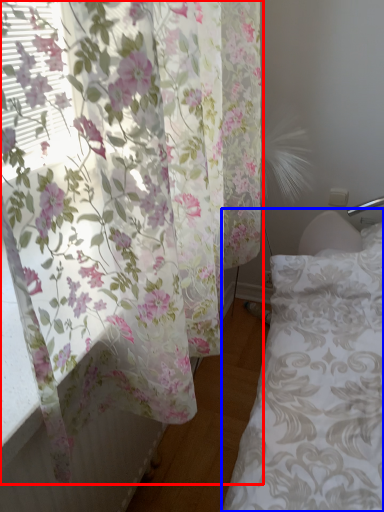
Question: Which object is closer to the camera taking this photo, curtain (highlighted by a red box) or bed frame (highlighted by a blue box)?

Choices:
 (A) curtain
 (B) bed frame

Answer: (A)